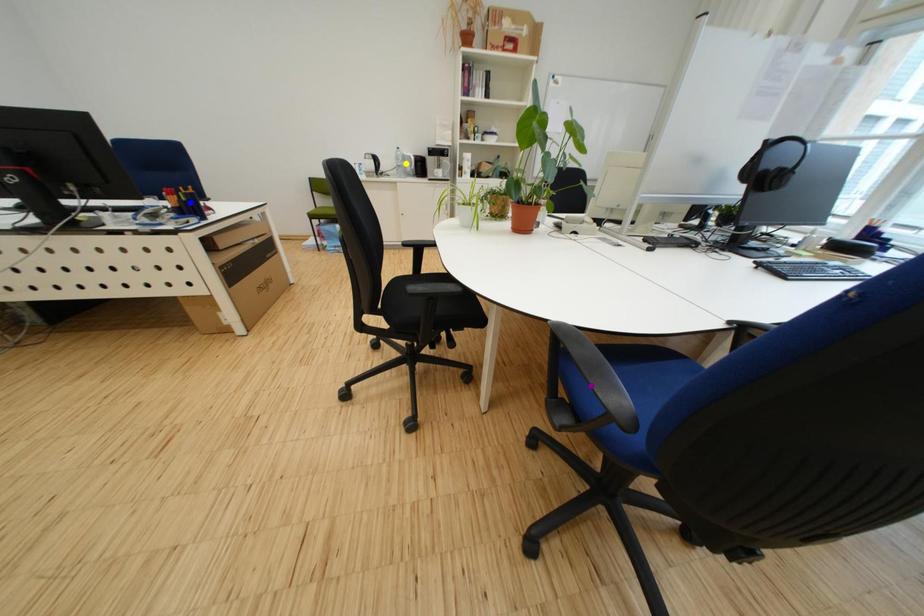
Order these from nearest to farthest:
blue point | purple point | yellow point

purple point < blue point < yellow point